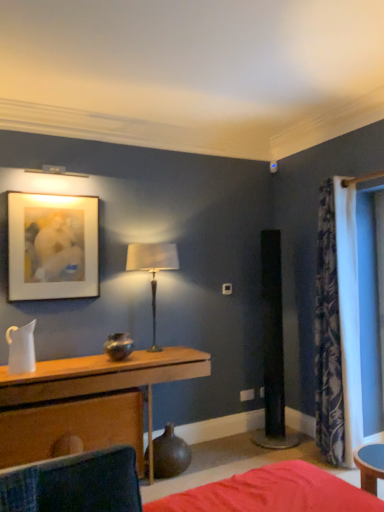
Question: Does matte brown vase at lower center appear on the left side of red fabric bed at lower center?

Choices:
 (A) yes
 (B) no

Answer: (A)

Question: From the image's perspective, is matte brown vase at lower center above red fabric bed at lower center?

Choices:
 (A) no
 (B) yes

Answer: (B)

Question: Is matte brown vase at lower center behind red fabric bed at lower center?

Choices:
 (A) yes
 (B) no

Answer: (A)

Question: From a real-world perspective, does matte brown vase at lower center sit lower than red fabric bed at lower center?

Choices:
 (A) yes
 (B) no

Answer: (B)

Question: Can you confirm if matte brown vase at lower center is positioned to the right of red fabric bed at lower center?

Choices:
 (A) no
 (B) yes

Answer: (A)

Question: Can you confirm if matte brown vase at lower center is wider than red fabric bed at lower center?

Choices:
 (A) no
 (B) yes

Answer: (A)

Question: Is velvet dark green swivel chair at lower left next to matte white picture frame at upper left and touching it?

Choices:
 (A) yes
 (B) no

Answer: (B)

Question: Is velvet dark green swivel chair at lower left further to camera compared to matte white picture frame at upper left?

Choices:
 (A) yes
 (B) no

Answer: (B)

Question: Is velvet dark green swivel chair at lower left completely or partially outside of matte white picture frame at upper left?

Choices:
 (A) yes
 (B) no

Answer: (A)

Question: Is velvet dark green swivel chair at lower left to the right of matte white picture frame at upper left from the viewer's perspective?

Choices:
 (A) no
 (B) yes

Answer: (B)

Question: Considering the relative sizes of velvet dark green swivel chair at lower left and matte white picture frame at upper left in the image provided, is velvet dark green swivel chair at lower left wider than matte white picture frame at upper left?

Choices:
 (A) yes
 (B) no

Answer: (A)

Question: From the image's perspective, is velvet dark green swivel chair at lower left located beneath matte white picture frame at upper left?

Choices:
 (A) no
 (B) yes

Answer: (B)

Question: Is wooden table at center bigger than floral fabric curtain at right?

Choices:
 (A) no
 (B) yes

Answer: (B)